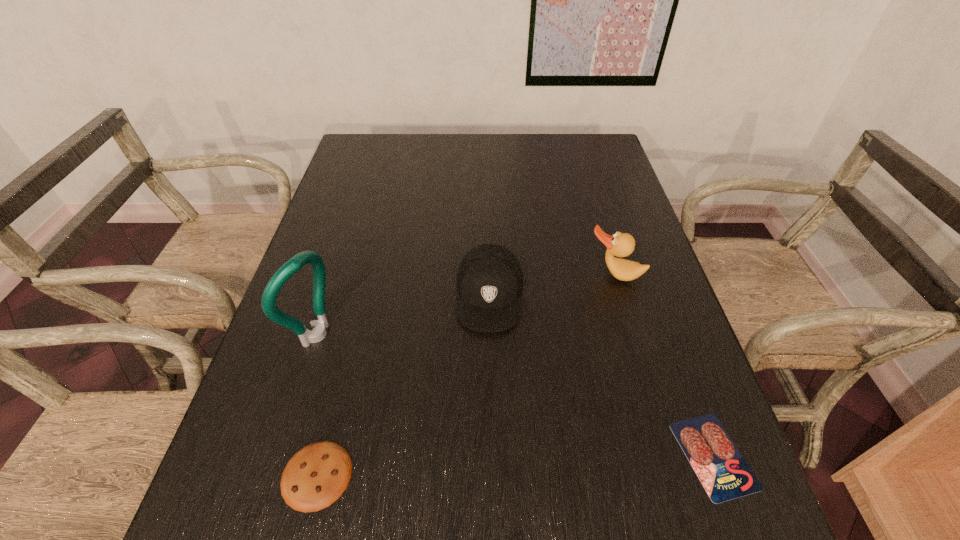
You are a GUI agent. You are given a task and a screenshot of the screen. Output one action in this format:
    pyautogui.click(x=<x>, y=<y>)
    Task: Click on the blank space at the near left corner of the desktop
    The width and height of the screenshot is (960, 540).
    Given the screenshot: What is the action you would take?
    point(276,436)

Identify the location of free spot between the third shortest object and the second shortest object. (403, 385).

The width and height of the screenshot is (960, 540). Find the location of `free spot between the fourth tallest object and the bottle opener`. free spot between the fourth tallest object and the bottle opener is located at coordinates (317, 405).

This screenshot has height=540, width=960. In order to click on vacant region between the cookie and the bottle opener in this screenshot , I will do (x=317, y=405).

Identify the location of vacant area between the cookie and the shortest object. Image resolution: width=960 pixels, height=540 pixels. (516, 465).

I want to click on free space between the salami and the third object from left to right, so click(x=602, y=375).

Identify the location of vacant area that lies between the tallest object and the shortest object. (515, 395).

At what (x,y) coordinates should I click in order to perform the action: click on unoccupied area between the fourth shortest object and the cap. Please return your answer as a coordinate pair (x, y). The image size is (960, 540). Looking at the image, I should click on (552, 285).

Identify the location of vacant area between the cap and the second tallest object. (552, 285).

At what (x,y) coordinates should I click in order to perform the action: click on empty location between the salami and the bottle opener. Please return your answer as a coordinate pair (x, y). Looking at the image, I should click on (515, 395).